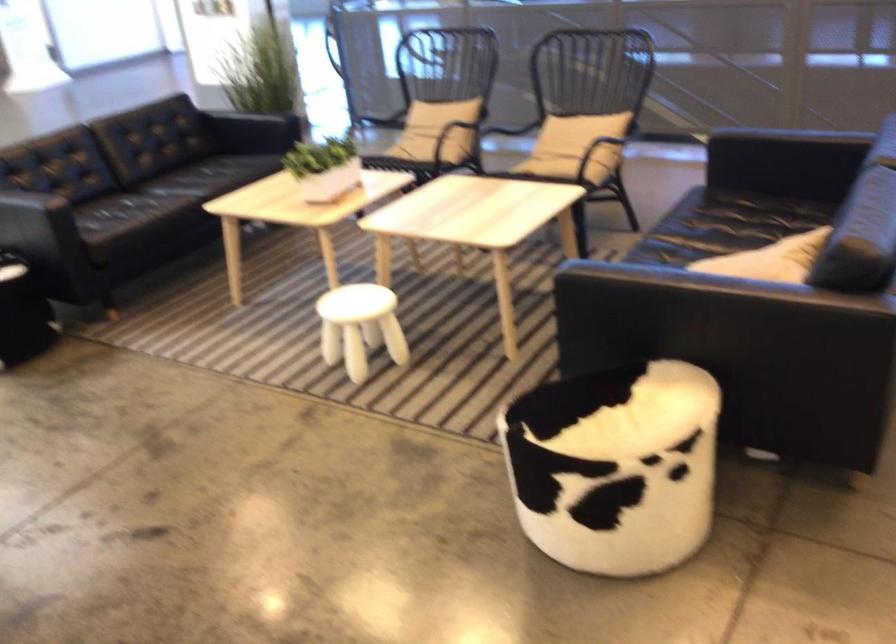
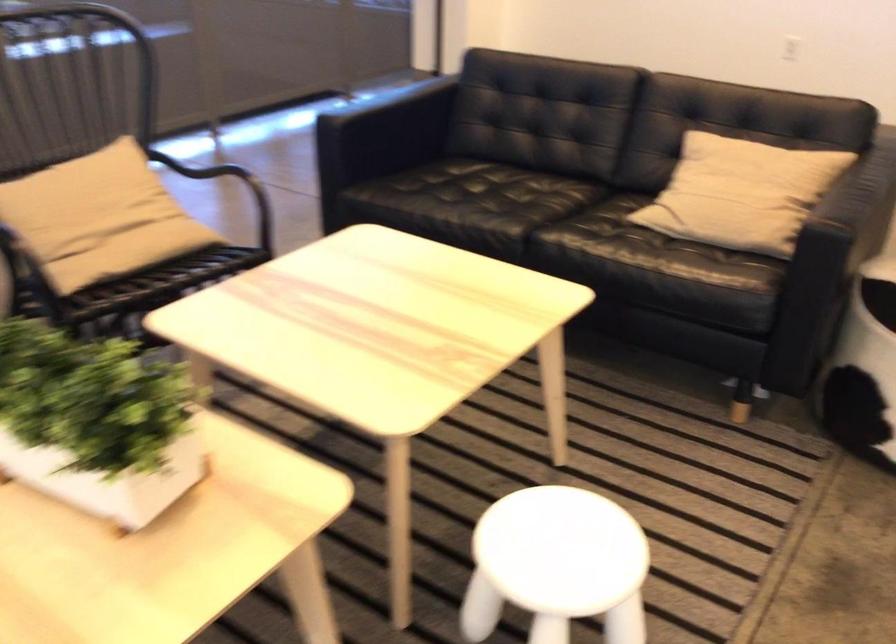
Where in the second image is the point corresponding to [547,160] from the first image?

(151, 254)